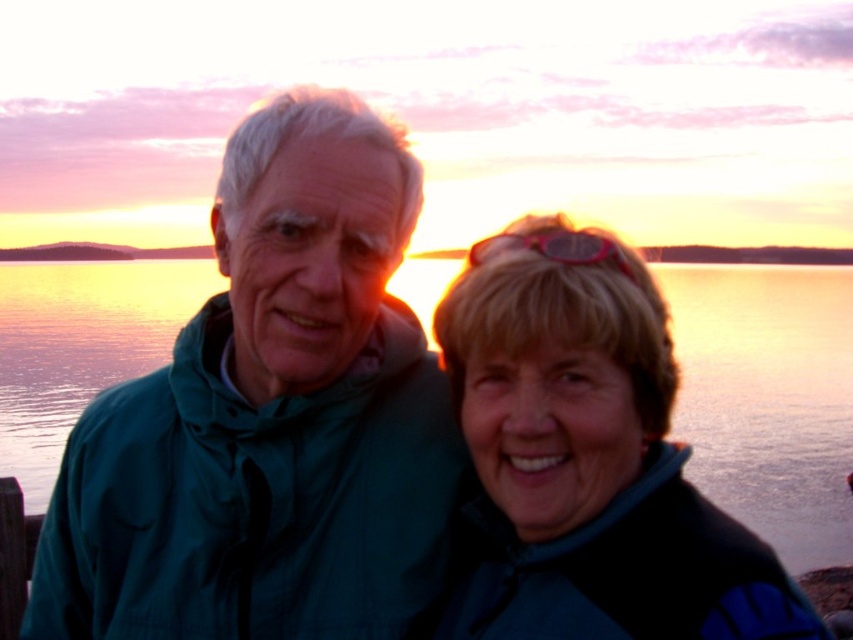
From the picture: You are a photographer trying to capture the reflection of the two people in the glossy water at center. Based on their positions, can you estimate whether their reflections will be fully visible in the water?

The glossy water at center is positioned at point (x=769, y=397), which means it is located near the bottom center of the image. Since both individuals are standing close together against the backdrop of the sunset, their reflections would likely be fully visible in the water as long as they are within the reflective area of the water surface. However, the exact visibility depends on the angle of the water surface and the camera perspective, which are not specified here.

You are a photographer standing 3 meters away from the two people in the image. You want to take a photo that includes both the blue fleece jacket at center and the other person. Can you fit both into the frame without moving closer or farther away?

The two people are 1.97 meters apart. Since you are 3 meters away, the distance between them is within the camera frame at that distance. Yes, you can fit both the blue fleece jacket at center and the other person in the frame without moving.

You are a photographer trying to capture the reflection of the pink translucent goggles at upper center in the glossy water at center. Based on their positions, do you think the reflection will appear to the left or right of the goggles?

The glossy water at center is to the left of the pink translucent goggles at upper center. Since reflections are mirrored, the reflection of the goggles would appear to the right of their actual position, so the reflection would be on the right side of the glossy water at center.